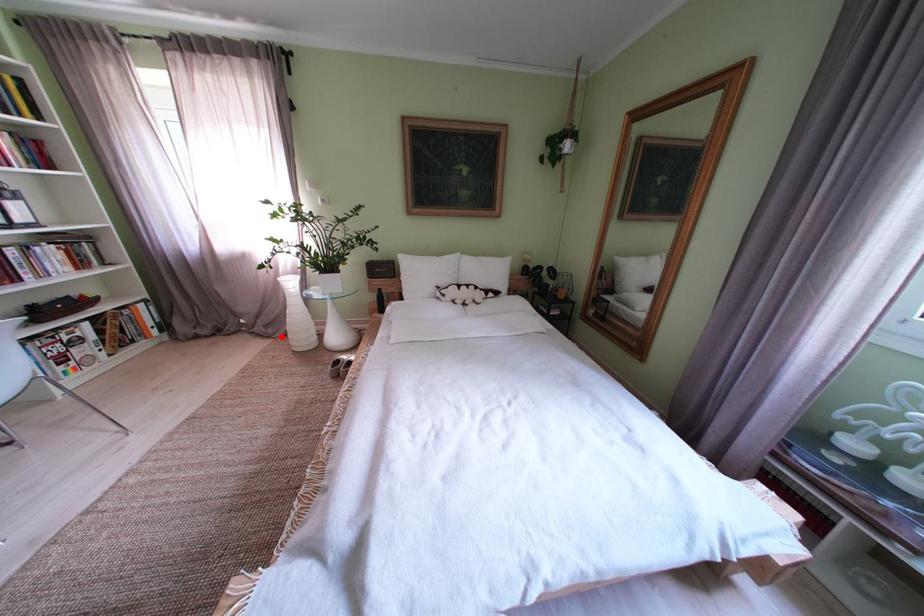
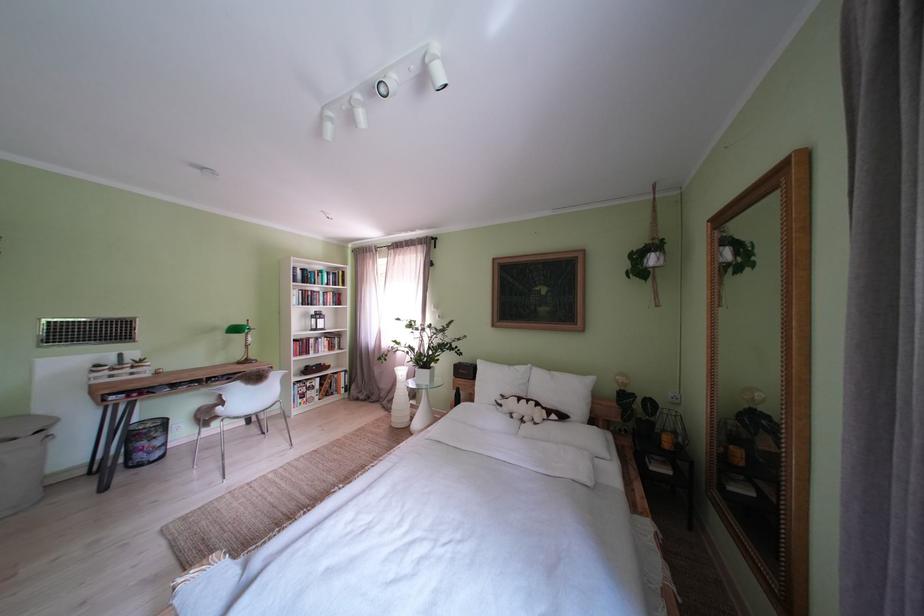
Question: I am providing you with two images of the same scene from different viewpoints. Image1 has a red point marked. In image2, the corresponding 3D location appears at what relative position? Reply with the corresponding letter.

Choices:
 (A) Closer
 (B) Farther

Answer: (B)